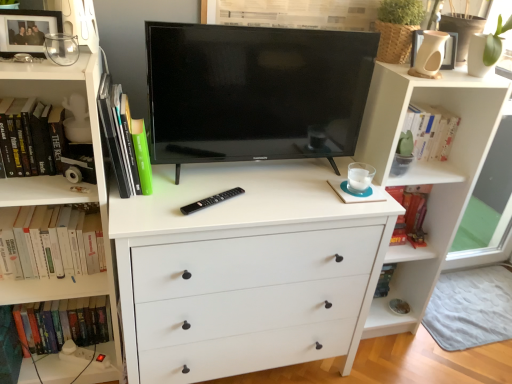
Question: Should I look upward or downward to see green matte book at left, marked as the second book in a top-to-bottom arrangement?

Choices:
 (A) up
 (B) down

Answer: (A)

Question: Is hardcover book at left, positioned as the 4th book in bottom-to-top order, oriented away from hardcover book at left, acting as the fourth book starting from the top?

Choices:
 (A) yes
 (B) no

Answer: (B)

Question: Is hardcover book at left, the 1th book in the top-to-bottom sequence, in contact with hardcover book at left, acting as the fourth book starting from the top?

Choices:
 (A) no
 (B) yes

Answer: (A)

Question: Can you confirm if hardcover book at left, positioned as the 4th book in bottom-to-top order, is smaller than hardcover book at left, marked as the first book in a bottom-to-top arrangement?

Choices:
 (A) no
 (B) yes

Answer: (B)

Question: Is hardcover book at left, acting as the fourth book starting from the top, inside hardcover book at left, the 1th book in the top-to-bottom sequence?

Choices:
 (A) no
 (B) yes

Answer: (A)

Question: From the image's perspective, is hardcover book at left, positioned as the 4th book in bottom-to-top order, located beneath hardcover book at left, marked as the first book in a bottom-to-top arrangement?

Choices:
 (A) no
 (B) yes

Answer: (A)

Question: Does hardcover book at left, the 1th book in the top-to-bottom sequence, lie behind hardcover book at left, acting as the fourth book starting from the top?

Choices:
 (A) no
 (B) yes

Answer: (A)

Question: Does hardcover book at left, positioned as the 4th book in bottom-to-top order, turn towards matte black picture frame at upper left, positioned as the 2th picture frame in right-to-left order?

Choices:
 (A) no
 (B) yes

Answer: (A)

Question: Are hardcover book at left, positioned as the 4th book in bottom-to-top order, and matte black picture frame at upper left, the 1th picture frame positioned from the left, beside each other?

Choices:
 (A) yes
 (B) no

Answer: (B)

Question: Is there a large distance between hardcover book at left, positioned as the 4th book in bottom-to-top order, and matte black picture frame at upper left, which ranks as the 2th picture frame in back-to-front order?

Choices:
 (A) yes
 (B) no

Answer: (B)

Question: From a real-world perspective, is hardcover book at left, positioned as the 4th book in bottom-to-top order, over matte black picture frame at upper left, which is the first picture frame in front-to-back order?

Choices:
 (A) yes
 (B) no

Answer: (B)

Question: Is matte black picture frame at upper left, positioned as the 2th picture frame in right-to-left order, completely or partially inside hardcover book at left, the 1th book in the top-to-bottom sequence?

Choices:
 (A) yes
 (B) no

Answer: (B)

Question: Can you confirm if hardcover book at left, the 1th book in the top-to-bottom sequence, is taller than matte black picture frame at upper left, which is the first picture frame in front-to-back order?

Choices:
 (A) yes
 (B) no

Answer: (A)

Question: Is matte black picture frame at upper left, positioned as the 2th picture frame in right-to-left order, facing towards hardcover book at left, the 1th book in the top-to-bottom sequence?

Choices:
 (A) yes
 (B) no

Answer: (B)